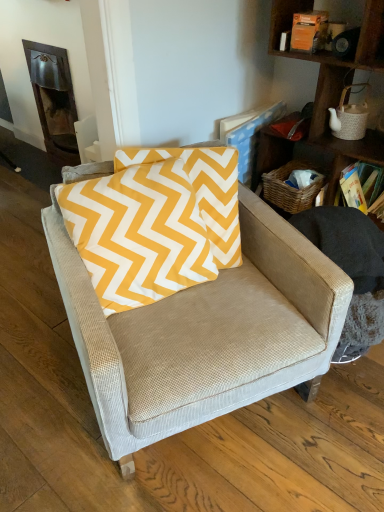
Question: Is beige fabric chair at center at the back of yellow cotton pillow at center?

Choices:
 (A) no
 (B) yes

Answer: (B)

Question: Can you confirm if yellow cotton pillow at center is positioned to the right of beige fabric chair at center?

Choices:
 (A) no
 (B) yes

Answer: (A)

Question: From a real-world perspective, is yellow cotton pillow at center located higher than beige fabric chair at center?

Choices:
 (A) no
 (B) yes

Answer: (B)

Question: From the image's perspective, does yellow cotton pillow at center appear lower than beige fabric chair at center?

Choices:
 (A) yes
 (B) no

Answer: (B)

Question: Is yellow cotton pillow at center outside of beige fabric chair at center?

Choices:
 (A) yes
 (B) no

Answer: (B)

Question: In terms of width, does dark wood fireplace at upper left look wider or thinner when compared to woven wood shelf at upper right?

Choices:
 (A) wide
 (B) thin

Answer: (B)

Question: From the image's perspective, is dark wood fireplace at upper left located above or below woven wood shelf at upper right?

Choices:
 (A) above
 (B) below

Answer: (A)

Question: Is dark wood fireplace at upper left inside or outside of woven wood shelf at upper right?

Choices:
 (A) outside
 (B) inside

Answer: (A)

Question: Is dark wood fireplace at upper left bigger or smaller than woven wood shelf at upper right?

Choices:
 (A) small
 (B) big

Answer: (A)

Question: From their relative heights in the image, would you say woven wood shelf at upper right is taller or shorter than hardcover book at upper right?

Choices:
 (A) tall
 (B) short

Answer: (A)

Question: Would you say woven wood shelf at upper right is inside or outside hardcover book at upper right?

Choices:
 (A) inside
 (B) outside

Answer: (B)

Question: Is point (291, 14) positioned closer to the camera than point (367, 181)?

Choices:
 (A) farther
 (B) closer

Answer: (B)

Question: Visually, is woven wood shelf at upper right positioned to the left or to the right of hardcover book at upper right?

Choices:
 (A) right
 (B) left

Answer: (B)

Question: Looking at the image, does beige fabric chair at center seem bigger or smaller compared to yellow cotton pillow at center?

Choices:
 (A) small
 (B) big

Answer: (B)

Question: Is beige fabric chair at center in front of or behind yellow cotton pillow at center in the image?

Choices:
 (A) behind
 (B) front

Answer: (B)